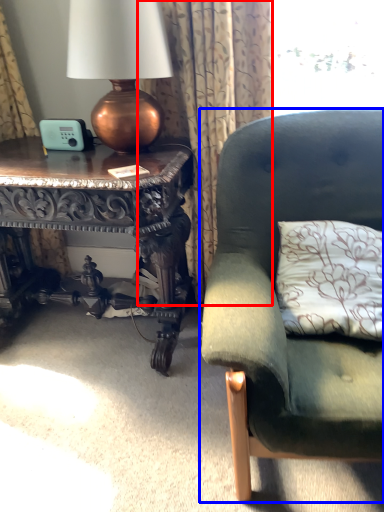
Question: Which point is further to the camera, curtain (highlighted by a red box) or studio couch (highlighted by a blue box)?

Choices:
 (A) curtain
 (B) studio couch

Answer: (A)